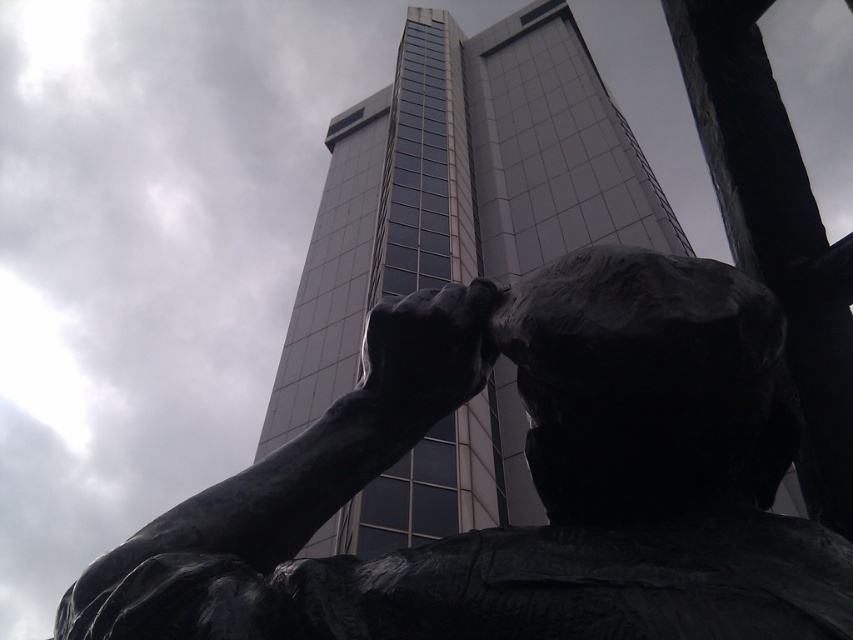
Question: Which point is closer to the camera?

Choices:
 (A) smooth glass tower at center
 (B) black polished statue at center

Answer: (B)

Question: Is black polished statue at center closer to the viewer compared to smooth glass tower at center?

Choices:
 (A) yes
 (B) no

Answer: (A)

Question: Is black polished statue at center to the left of smooth glass tower at center from the viewer's perspective?

Choices:
 (A) yes
 (B) no

Answer: (B)

Question: Which object is farther from the camera taking this photo?

Choices:
 (A) black polished statue at center
 (B) smooth glass tower at center

Answer: (B)

Question: Is black polished statue at center bigger than smooth glass tower at center?

Choices:
 (A) yes
 (B) no

Answer: (B)